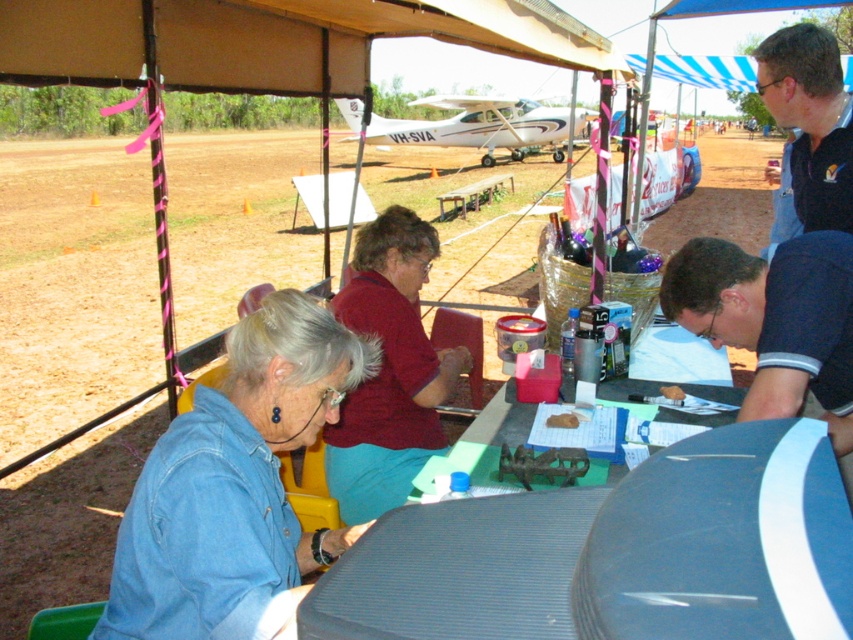
Question: Which object is the closest to the matte red shirt at center?

Choices:
 (A) green plastic table at center
 (B) denim jacket at lower left
 (C) dark blue shirt at lower right
 (D) black polo shirt at upper right

Answer: (A)

Question: Can you confirm if matte red shirt at center is positioned above brown crumbly cake at center?

Choices:
 (A) yes
 (B) no

Answer: (A)

Question: Which object is farther from the camera taking this photo?

Choices:
 (A) brown crumbly bread at center
 (B) denim jacket at lower left
 (C) matte red shirt at center
 (D) black polo shirt at upper right

Answer: (D)

Question: Can you confirm if brown crumbly bread at center is positioned to the right of brown crumbly cake at center?

Choices:
 (A) yes
 (B) no

Answer: (B)

Question: Can you confirm if dark blue shirt at lower right is wider than black polo shirt at upper right?

Choices:
 (A) no
 (B) yes

Answer: (B)

Question: Which of the following is the closest to the observer?

Choices:
 (A) black polo shirt at upper right
 (B) denim jacket at lower left
 (C) brown crumbly bread at center

Answer: (B)